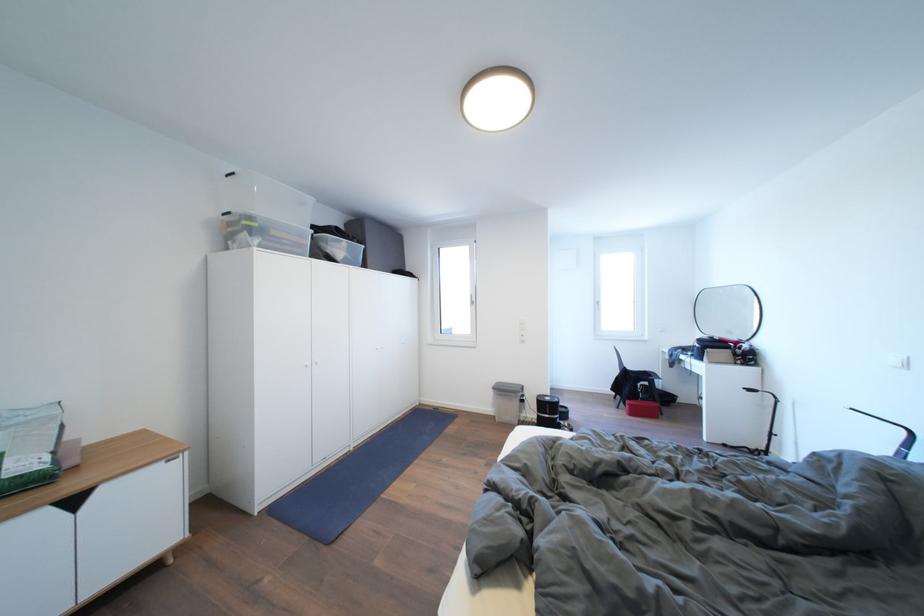
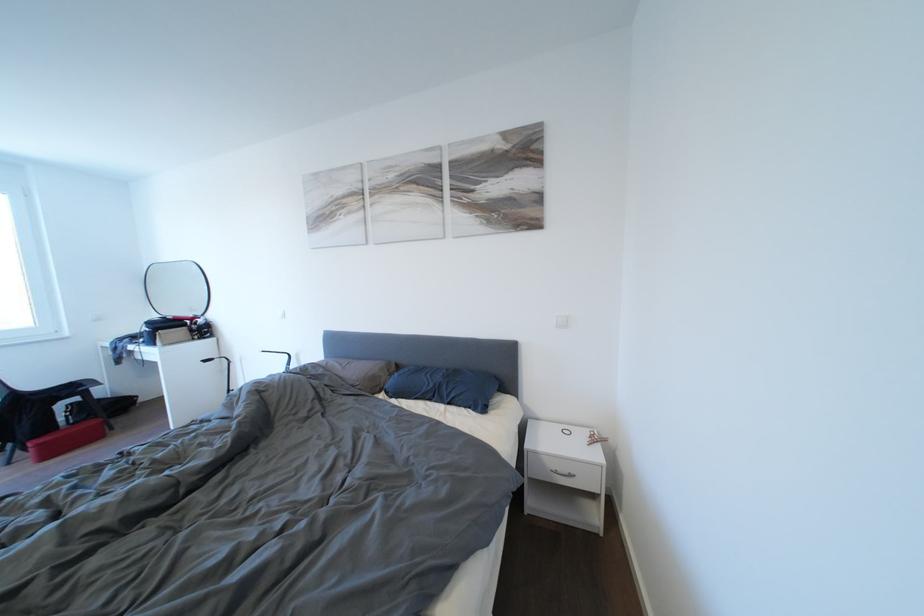
The point at (638, 410) is marked in the first image. Where is the corresponding point in the second image?

(46, 450)